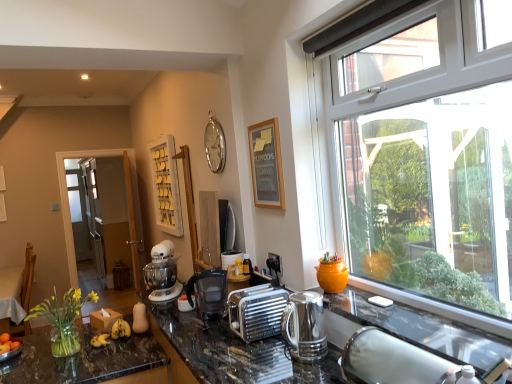
Question: Which direction should I rotate to face metallic silver toaster at center, the second appliance when ordered from front to back, — up or down?

Choices:
 (A) down
 (B) up

Answer: (A)

Question: From the image's perspective, does polished granite countertop at center appear lower than metallic silver toaster at center, the second appliance positioned from the bottom?

Choices:
 (A) no
 (B) yes

Answer: (B)

Question: Does polished granite countertop at center have a lesser height compared to metallic silver toaster at center, the second appliance when ordered from front to back?

Choices:
 (A) no
 (B) yes

Answer: (A)

Question: From a real-world perspective, is polished granite countertop at center physically above metallic silver toaster at center, which ranks as the 1th appliance in back-to-front order?

Choices:
 (A) no
 (B) yes

Answer: (A)

Question: Is polished granite countertop at center positioned in front of metallic silver toaster at center, which ranks as the 1th appliance in back-to-front order?

Choices:
 (A) yes
 (B) no

Answer: (A)

Question: Is polished granite countertop at center facing away from metallic silver toaster at center, the first appliance positioned from the top?

Choices:
 (A) no
 (B) yes

Answer: (A)

Question: Does polished granite countertop at center have a greater height compared to metallic silver toaster at center, the second appliance positioned from the bottom?

Choices:
 (A) no
 (B) yes

Answer: (B)

Question: Can you see metallic silver toaster at center, the second appliance when ordered from front to back, touching black plastic coffee machine at center, which is the first coffee machine from back to front?

Choices:
 (A) yes
 (B) no

Answer: (B)

Question: Is metallic silver toaster at center, which ranks as the 1th appliance in back-to-front order, outside black plastic coffee machine at center, which appears as the 1th coffee machine when viewed from the left?

Choices:
 (A) yes
 (B) no

Answer: (A)

Question: From the image's perspective, would you say metallic silver toaster at center, the second appliance positioned from the bottom, is shown under black plastic coffee machine at center, which appears as the 1th coffee machine when viewed from the left?

Choices:
 (A) yes
 (B) no

Answer: (B)

Question: Considering the relative sizes of metallic silver toaster at center, the first appliance positioned from the top, and black plastic coffee machine at center, which is the first coffee machine from back to front, in the image provided, is metallic silver toaster at center, the first appliance positioned from the top, wider than black plastic coffee machine at center, which is the first coffee machine from back to front,?

Choices:
 (A) no
 (B) yes

Answer: (A)

Question: Is black plastic coffee machine at center, which appears as the 1th coffee machine when viewed from the left, located within metallic silver toaster at center, the second appliance when ordered from front to back?

Choices:
 (A) yes
 (B) no

Answer: (B)

Question: Considering the relative sizes of metallic silver toaster at center, the second appliance positioned from the bottom, and black plastic coffee machine at center, the 2th coffee machine when ordered from front to back, in the image provided, is metallic silver toaster at center, the second appliance positioned from the bottom, thinner than black plastic coffee machine at center, the 2th coffee machine when ordered from front to back,?

Choices:
 (A) no
 (B) yes

Answer: (B)

Question: From a real-world perspective, is white metallic mixer at center beneath white wooden shelf at upper center?

Choices:
 (A) no
 (B) yes

Answer: (B)